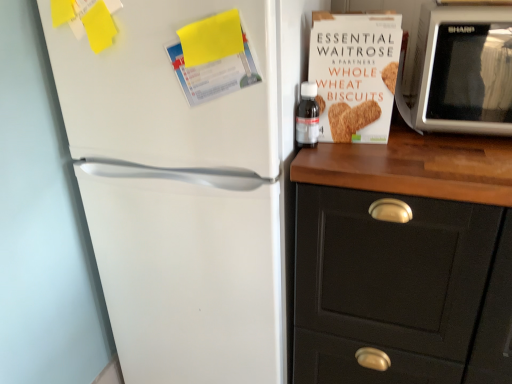
This screenshot has height=384, width=512. In order to click on vacant space to the right of transparent plastic bottle at upper right in this screenshot , I will do `click(389, 150)`.